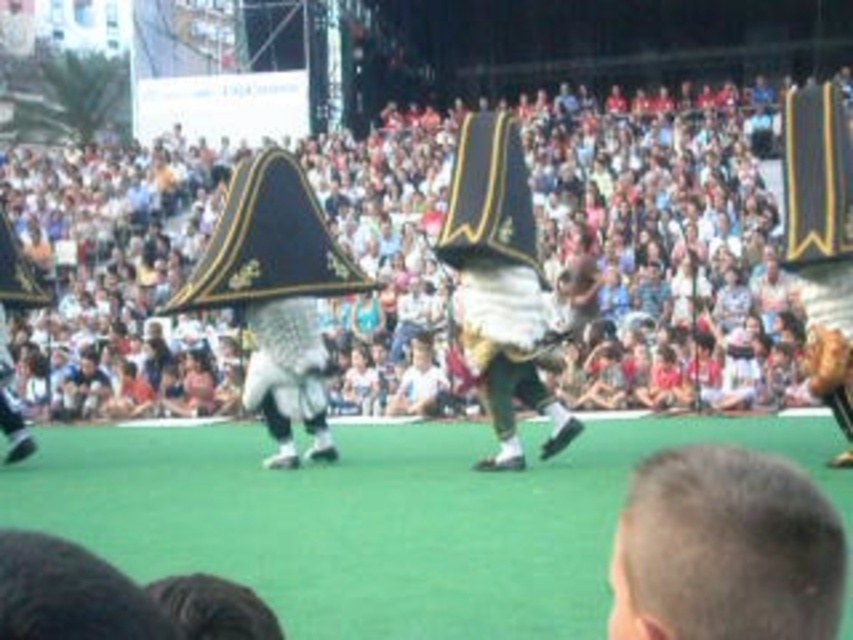
You are a photographer at the event and want to take a picture of the blonde hair at lower right without any obstruction from the matte white crowd at upper center. Can you position yourself in a way to achieve this?

The blonde hair at lower right is behind the matte white crowd at upper center, so positioning yourself in a way to avoid obstruction might be challenging. You might need to move to a lower angle or position where the crowd is not blocking the view.

You are a photographer at the event and want to capture a closeup of the blonde hair at lower right and the white fabric costume at center. Which object would appear smaller in the photo?

The blonde hair at lower right would appear smaller in the photo because it is thinner than the white fabric costume at center.

You are a photographer at the event and want to capture a photo of the blonde hair at lower right without the matte white crowd at upper center blocking it. What should you do?

Since the matte white crowd at upper center is positioned over the blonde hair at lower right, you should adjust your angle to avoid the crowd blocking the view of the blonde hair at lower right.